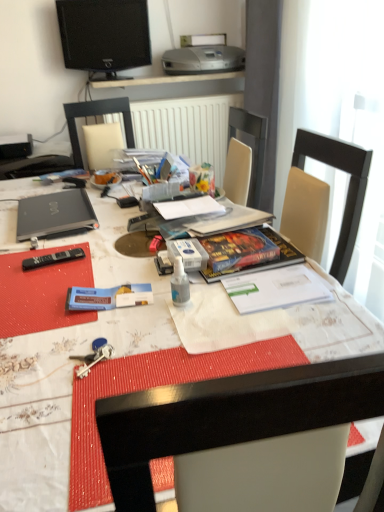
You are a GUI agent. You are given a task and a screenshot of the screen. Output one action in this format:
    pyautogui.click(x=<x>, y=<y>)
    Task: Click on the free space between black matte laptop at left and transparent plastic spray bottle at center
    Image resolution: width=384 pixels, height=512 pixels.
    Given the screenshot: What is the action you would take?
    pyautogui.click(x=113, y=252)